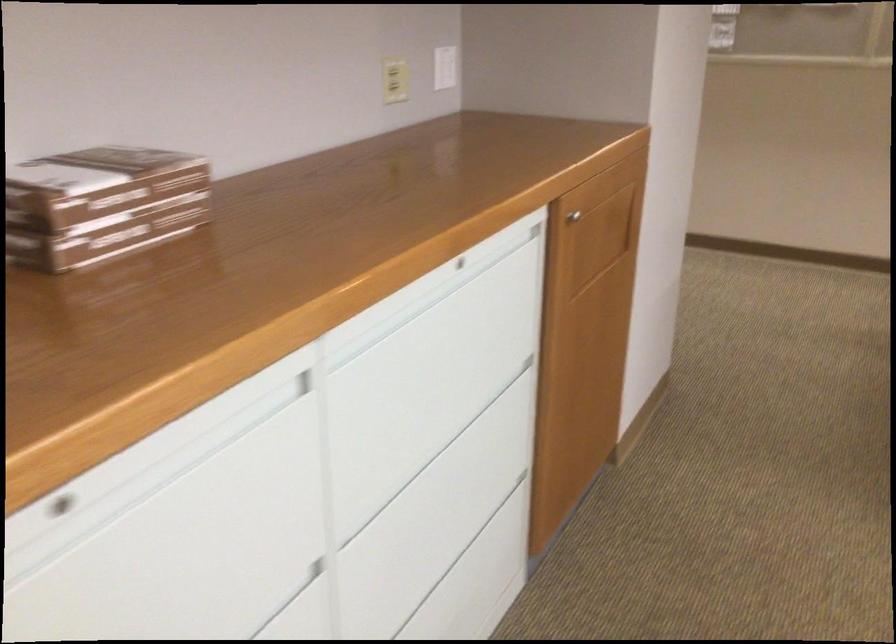
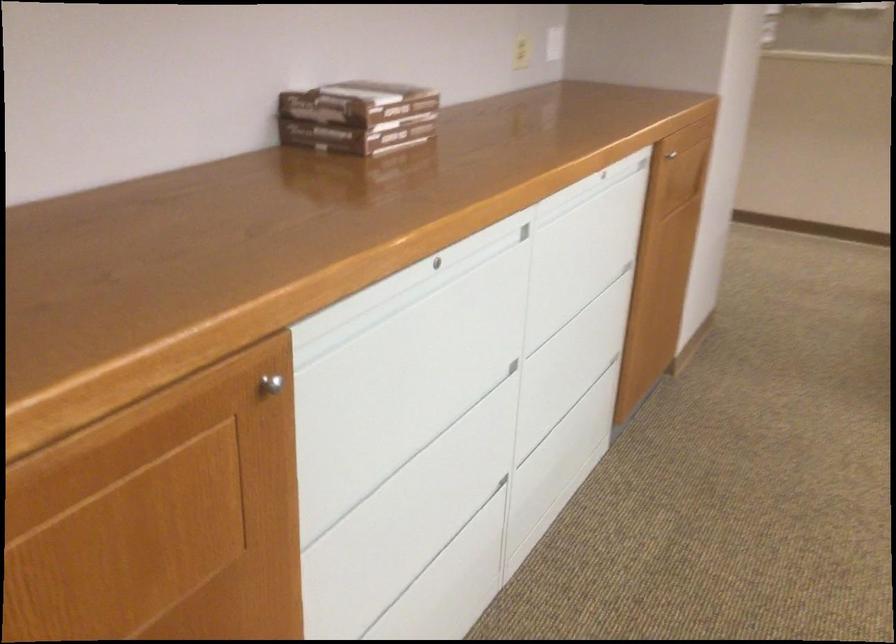
The point at (x=436, y=408) is marked in the first image. Where is the corresponding point in the second image?

(579, 279)